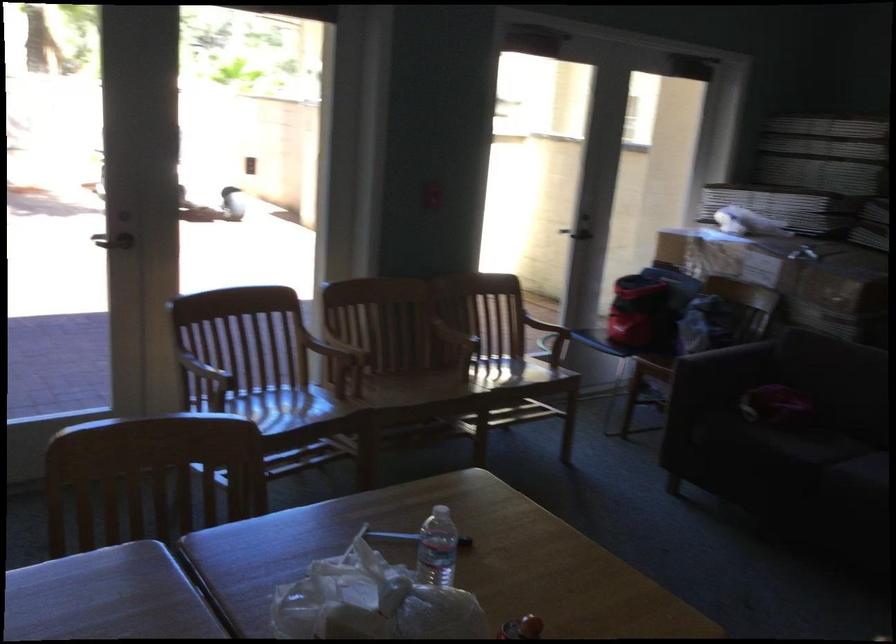
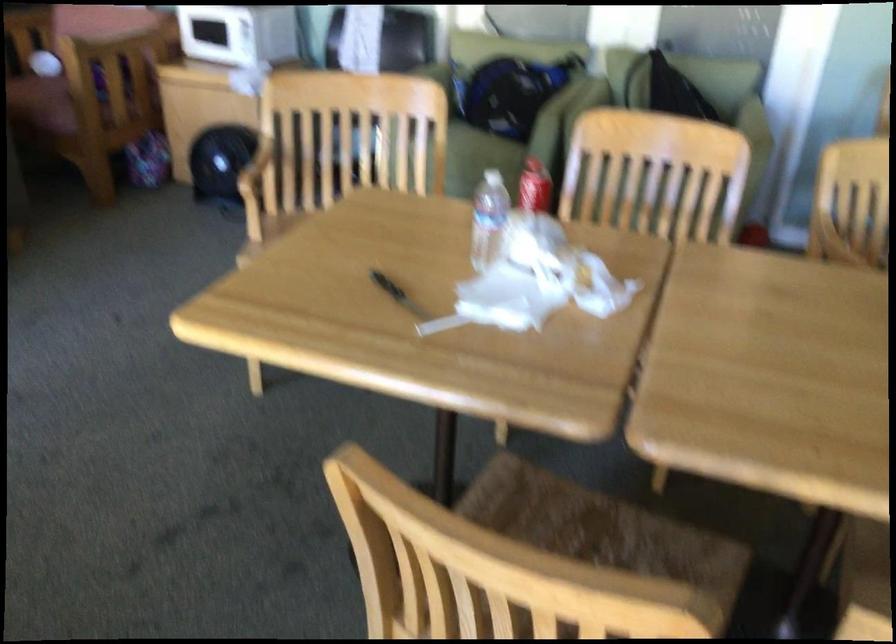
Question: I am providing you with two images of the same scene from different viewpoints. After the viewpoint changes to image2, which objects are now occluded?

Choices:
 (A) white flower pot
 (B) plastic water bottle
 (C) chair sitting surface
 (D) red soda bottle

Answer: (B)